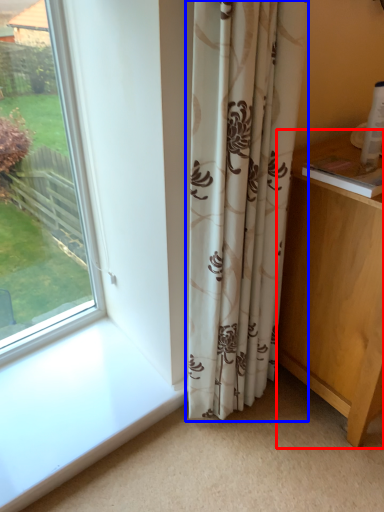
Question: Which object is further to the camera taking this photo, vanity (highlighted by a red box) or curtain (highlighted by a blue box)?

Choices:
 (A) vanity
 (B) curtain

Answer: (A)